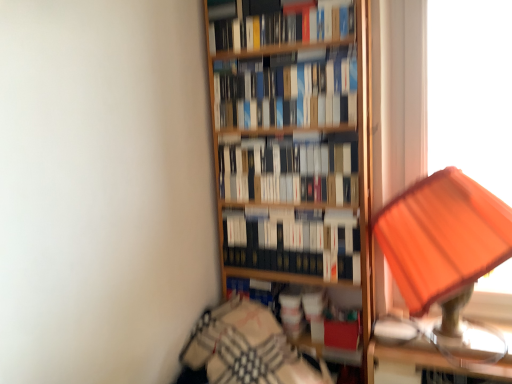
The width and height of the screenshot is (512, 384). In order to click on vacant space situated above hardcover books at center, acting as the 3th book starting from the top (from a real-world perspective) in this screenshot , I will do `click(284, 129)`.